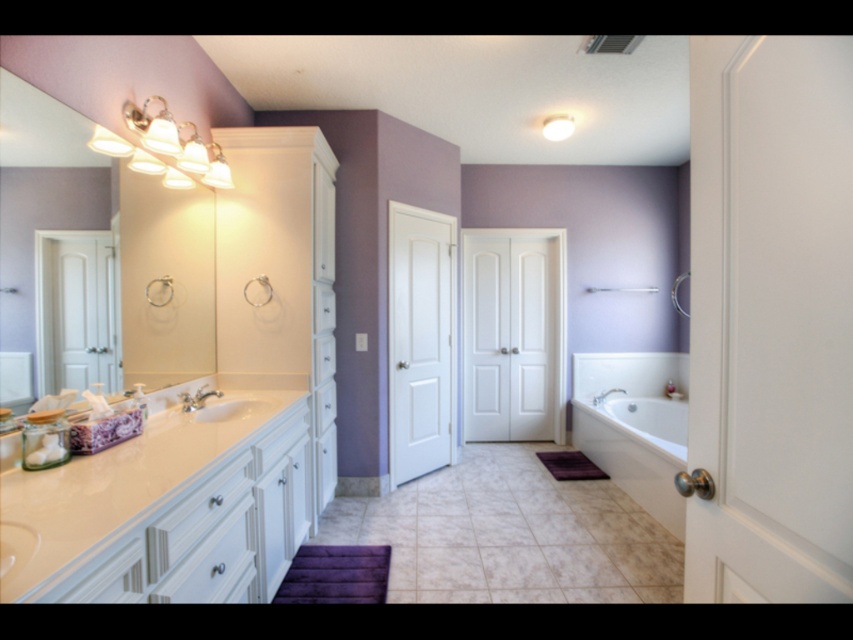
Is white glossy sink at center to the left of white glossy shower at center from the viewer's perspective?

Correct, you'll find white glossy sink at center to the left of white glossy shower at center.

Is white glossy sink at center wider than white glossy shower at center?

Incorrect, white glossy sink at center's width does not surpass white glossy shower at center's.

Who is more distant from viewer, (218, 404) or (648, 291)?

The point (648, 291) is more distant.

This screenshot has height=640, width=853. In order to click on white glossy sink at center in this screenshot , I will do `click(234, 408)`.

Can you confirm if white glossy sink at center is positioned to the right of silver metallic faucet at lower right?

Incorrect, white glossy sink at center is not on the right side of silver metallic faucet at lower right.

This screenshot has height=640, width=853. What do you see at coordinates (234, 408) in the screenshot?
I see `white glossy sink at center` at bounding box center [234, 408].

Where is `white glossy sink at center`? The height and width of the screenshot is (640, 853). white glossy sink at center is located at coordinates (234, 408).

What are the coordinates of `white glossy sink at center` in the screenshot? It's located at (234, 408).

What do you see at coordinates (621, 289) in the screenshot? This screenshot has height=640, width=853. I see `white glossy shower at center` at bounding box center [621, 289].

Can you confirm if white glossy shower at center is taller than silver metallic faucet at lower right?

No.

Image resolution: width=853 pixels, height=640 pixels. What do you see at coordinates (621, 289) in the screenshot? I see `white glossy shower at center` at bounding box center [621, 289].

Image resolution: width=853 pixels, height=640 pixels. I want to click on white glossy shower at center, so click(x=621, y=289).